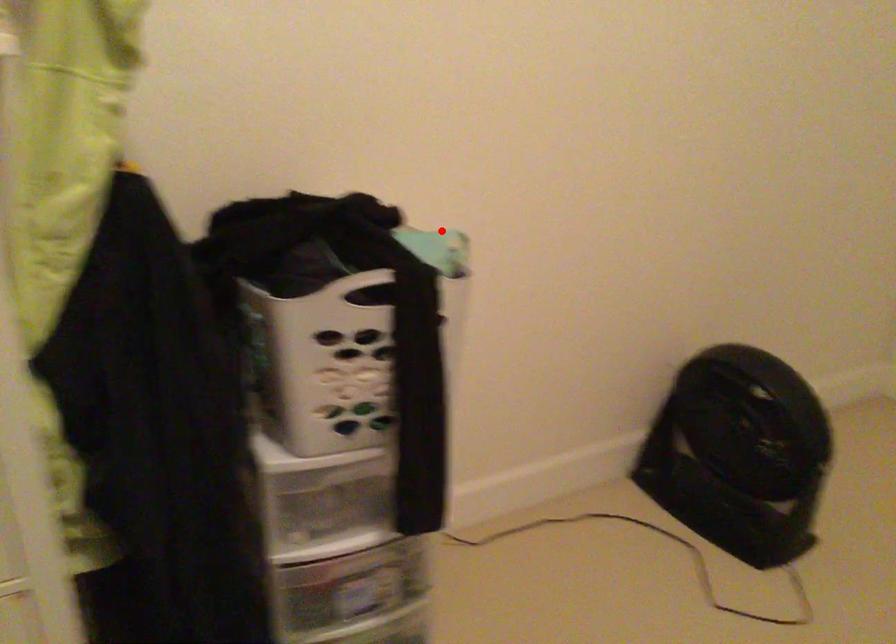
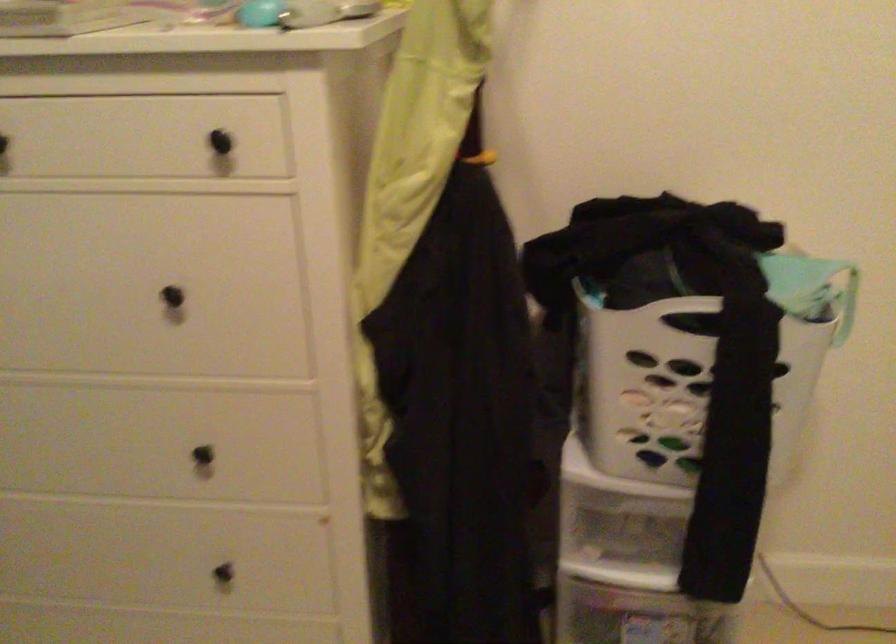
Question: I am providing you with two images of the same scene from different viewpoints. Image1 has a red point marked. In image2, the corresponding 3D location appears at what relative position? Reply with the corresponding letter.

Choices:
 (A) Closer
 (B) Farther

Answer: (A)